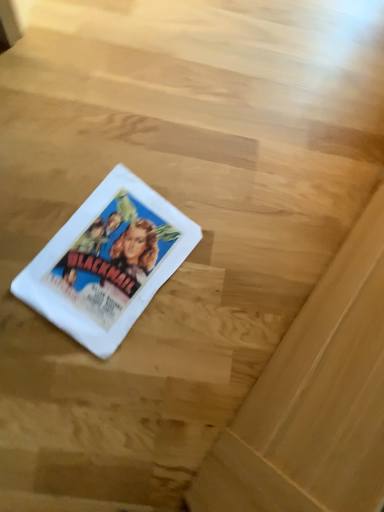
The image size is (384, 512). What are the coordinates of `empty space that is ontop of white fabric at center (from a real-world perspective)` in the screenshot? It's located at (111, 257).